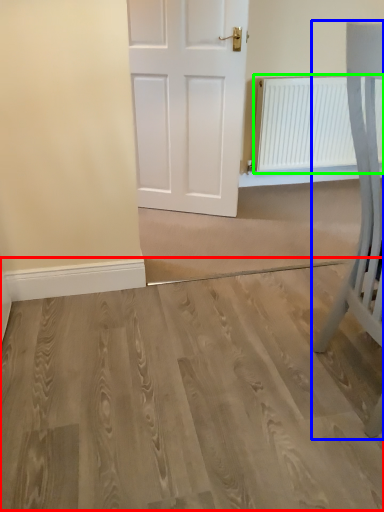
Question: Which is nearer to the plain (highlighted by a red box)? furniture (highlighted by a blue box) or radiator (highlighted by a green box).

Choices:
 (A) furniture
 (B) radiator

Answer: (A)